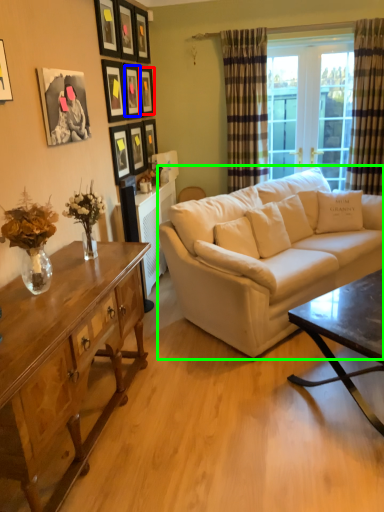
Question: Estimate the real-world distances between objects in this image. Which object is closer to picture frame (highlighted by a red box), picture frame (highlighted by a blue box) or studio couch (highlighted by a green box)?

Choices:
 (A) picture frame
 (B) studio couch

Answer: (A)